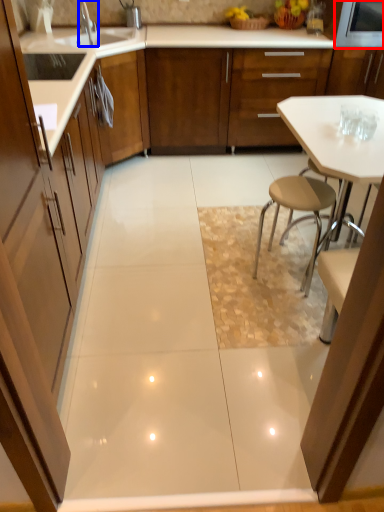
Question: Which of the following is the farthest to the observer, appliance (highlighted by a red box) or tap (highlighted by a blue box)?

Choices:
 (A) appliance
 (B) tap

Answer: (A)